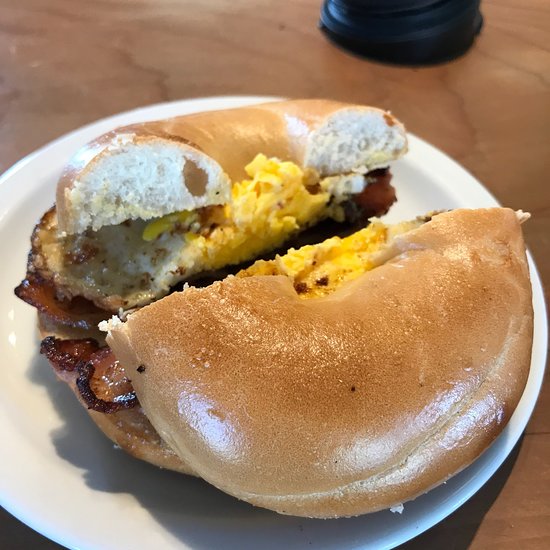
Identify the location of brown table. The width and height of the screenshot is (550, 550). (500, 157), (100, 88).